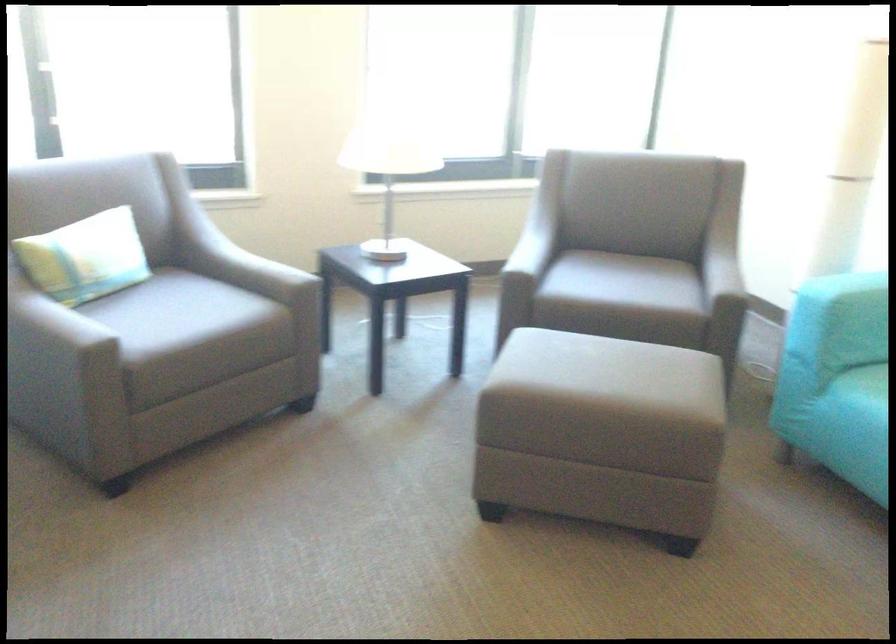
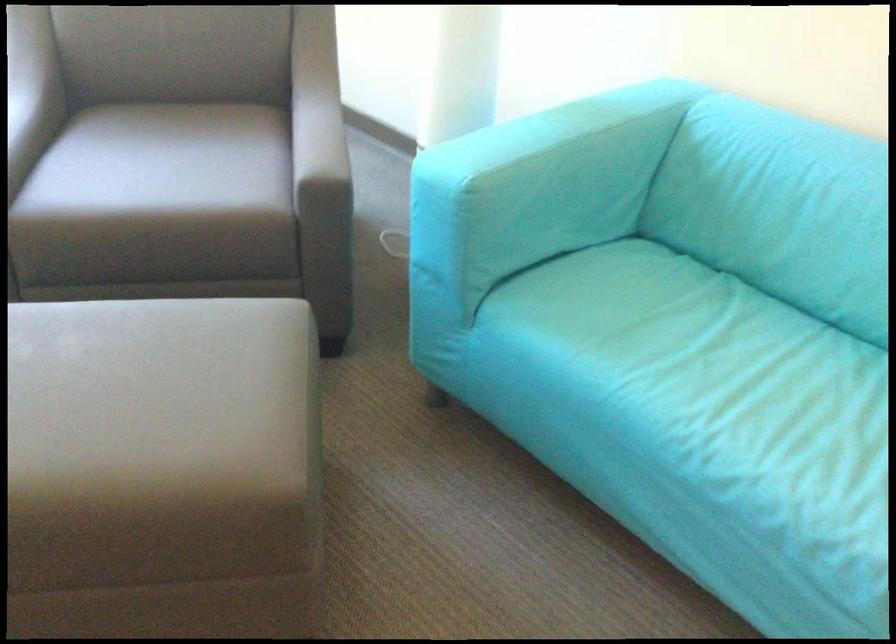
Find the pixel in the second image that matches (x=726, y=281) in the first image.

(330, 149)